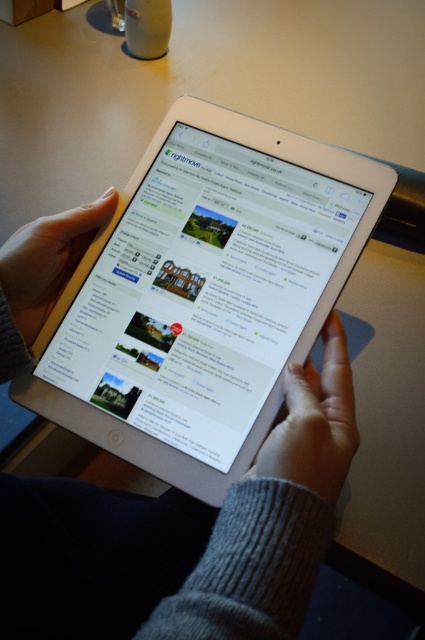
Does silver metallic tablet at center have a smaller size compared to smooth yellow finger at center?

Actually, silver metallic tablet at center might be larger than smooth yellow finger at center.

Can you confirm if silver metallic tablet at center is positioned to the left of smooth yellow finger at center?

In fact, silver metallic tablet at center is to the right of smooth yellow finger at center.

Does point (51, 372) lie in front of point (62, 228)?

Yes.

Where is `silver metallic tablet at center`? This screenshot has width=425, height=640. silver metallic tablet at center is located at coordinates (204, 294).

Can you confirm if silver metallic tablet at center is positioned to the right of gray woolen sweater at lower center?

Incorrect, silver metallic tablet at center is not on the right side of gray woolen sweater at lower center.

Is the position of silver metallic tablet at center more distant than that of gray woolen sweater at lower center?

That is True.

Does point (265, 352) lie behind point (337, 436)?

Yes, point (265, 352) is farther from viewer.

You are a GUI agent. You are given a task and a screenshot of the screen. Output one action in this format:
    pyautogui.click(x=<x>, y=<y>)
    Task: Click on the silver metallic tablet at center
    The height and width of the screenshot is (640, 425).
    Given the screenshot: What is the action you would take?
    pyautogui.click(x=204, y=294)

Can you confirm if gray woolen sweater at lower center is thinner than smooth yellow finger at center?

Yes, gray woolen sweater at lower center is thinner than smooth yellow finger at center.

Is gray woolen sweater at lower center closer to the viewer compared to smooth yellow finger at center?

Yes, it is in front of smooth yellow finger at center.

Find the location of a particular element. Image resolution: width=425 pixels, height=640 pixels. gray woolen sweater at lower center is located at coordinates (314, 420).